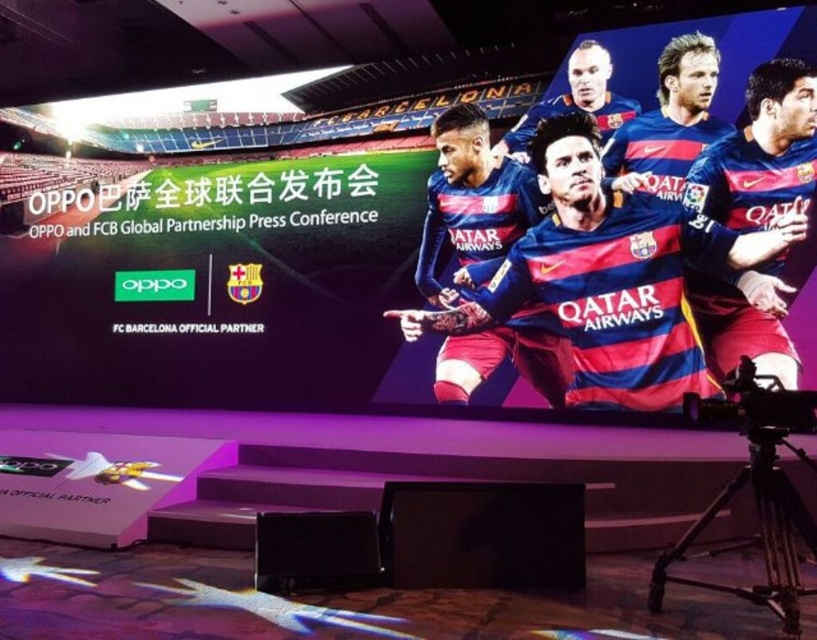
Is blue fabric jersey at center thinner than blue jersey at center?

No, blue fabric jersey at center is not thinner than blue jersey at center.

Is blue fabric jersey at center positioned in front of blue jersey at center?

That is False.

Measure the distance between blue fabric jersey at center and camera.

blue fabric jersey at center and camera are 18.63 feet apart.

Where is `blue fabric jersey at center`? Image resolution: width=817 pixels, height=640 pixels. blue fabric jersey at center is located at coordinates (471, 205).

Who is shorter, blue jersey at center or blue jersey at upper right?

With less height is blue jersey at upper right.

Which is below, blue jersey at center or blue jersey at upper right?

blue jersey at center is below.

Identify the location of blue jersey at center. (762, 152).

Is the position of blue jersey at upper right less distant than that of blue jersey at upper center?

Yes, it is in front of blue jersey at upper center.

Is blue jersey at upper right bigger than blue jersey at upper center?

No.

Is point (653, 170) closer to viewer compared to point (502, 134)?

Yes, it is in front of point (502, 134).

The image size is (817, 640). In order to click on blue jersey at upper right in this screenshot , I will do `click(668, 122)`.